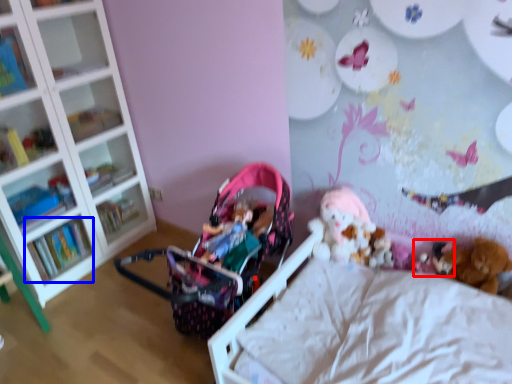
Question: Which object is further to the camera taking this photo, toy (highlighted by a red box) or book (highlighted by a blue box)?

Choices:
 (A) toy
 (B) book

Answer: (B)